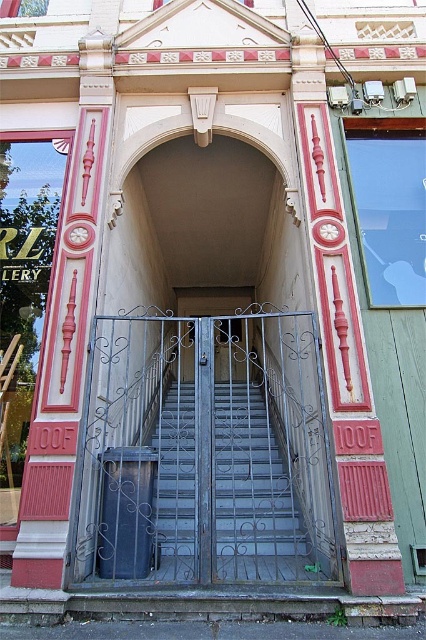
Question: Estimate the real-world distances between objects in this image. Which object is farther from the metallic gray gate at center?

Choices:
 (A) dark gray wrought iron gate at center
 (B) metallic gray stairs at center

Answer: (A)

Question: Does dark gray wrought iron gate at center appear on the left side of metallic gray stairs at center?

Choices:
 (A) yes
 (B) no

Answer: (B)

Question: Can you confirm if metallic gray stairs at center is positioned to the left of metallic gray gate at center?

Choices:
 (A) no
 (B) yes

Answer: (B)

Question: Considering the relative positions of dark gray wrought iron gate at center and metallic gray stairs at center in the image provided, where is dark gray wrought iron gate at center located with respect to metallic gray stairs at center?

Choices:
 (A) above
 (B) below

Answer: (A)

Question: Which object appears closest to the camera in this image?

Choices:
 (A) metallic gray gate at center
 (B) dark gray wrought iron gate at center
 (C) metallic gray stairs at center

Answer: (C)

Question: Which of the following is the closest to the observer?

Choices:
 (A) (261, 422)
 (B) (224, 320)

Answer: (A)